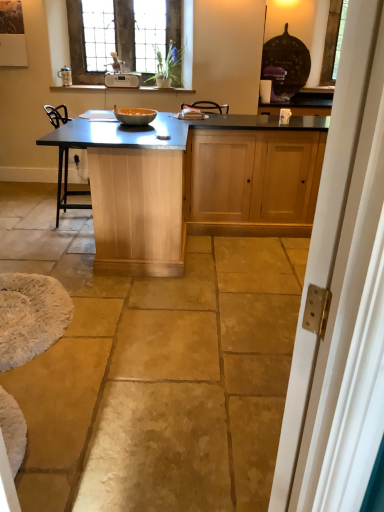
Where is `vacant area that lies between white fluffy rug at lower left and matte wood table at center`? The width and height of the screenshot is (384, 512). vacant area that lies between white fluffy rug at lower left and matte wood table at center is located at coordinates (94, 290).